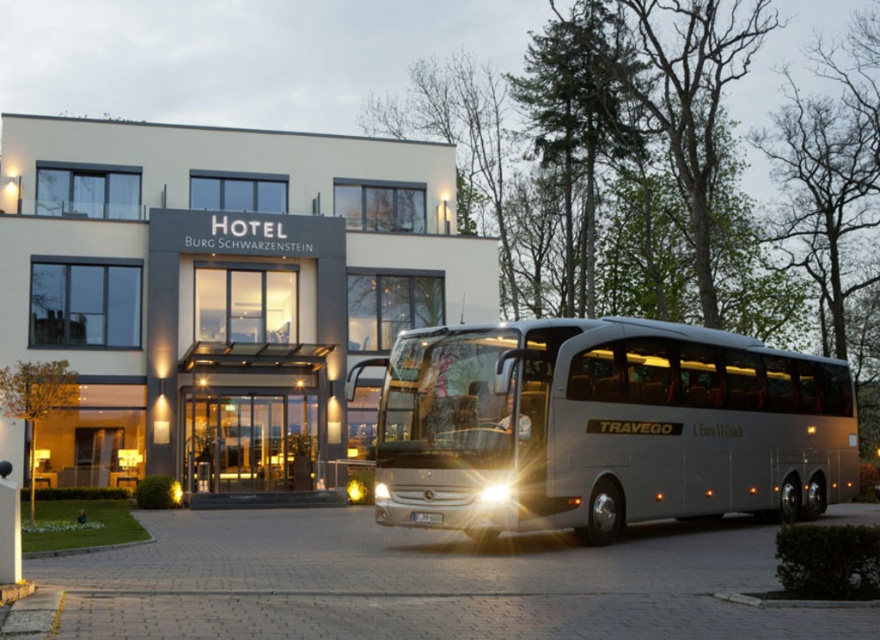
From the picture: You are a tour guide standing in front of the white matte building at center and the silver metallic coach at center. You need to direct your tourists to the coach. Which direction should they walk relative to the building?

The white matte building at center is to the left of the silver metallic coach at center, so tourists should walk to the right of the building to reach the coach.